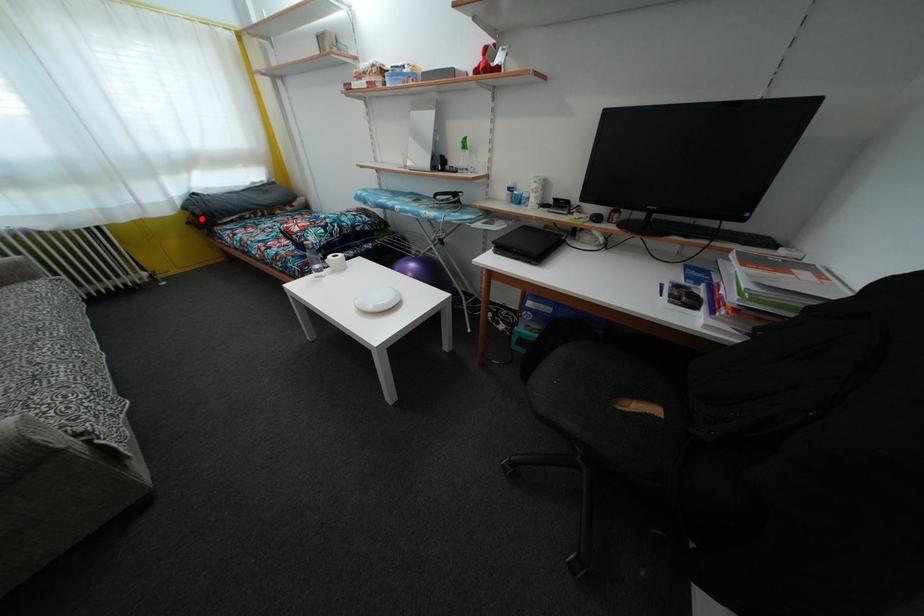
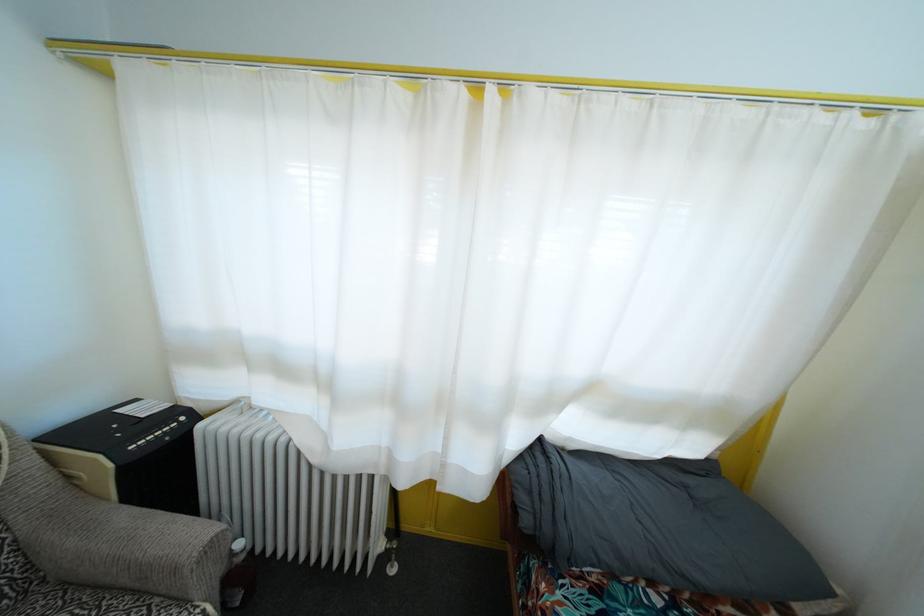
Question: I am providing you with two images of the same scene from different viewpoints. In image1, a red point is highlighted. Considering the same 3D point in image2, which of the following is correct?

Choices:
 (A) It is closer
 (B) It is farther

Answer: (B)